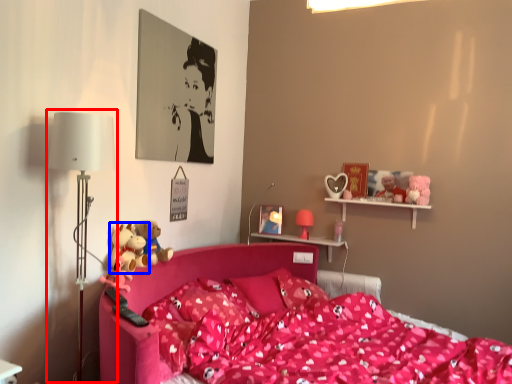
Question: Which point is further to the camera, table lamp (highlighted by a red box) or toy (highlighted by a blue box)?

Choices:
 (A) table lamp
 (B) toy

Answer: (B)